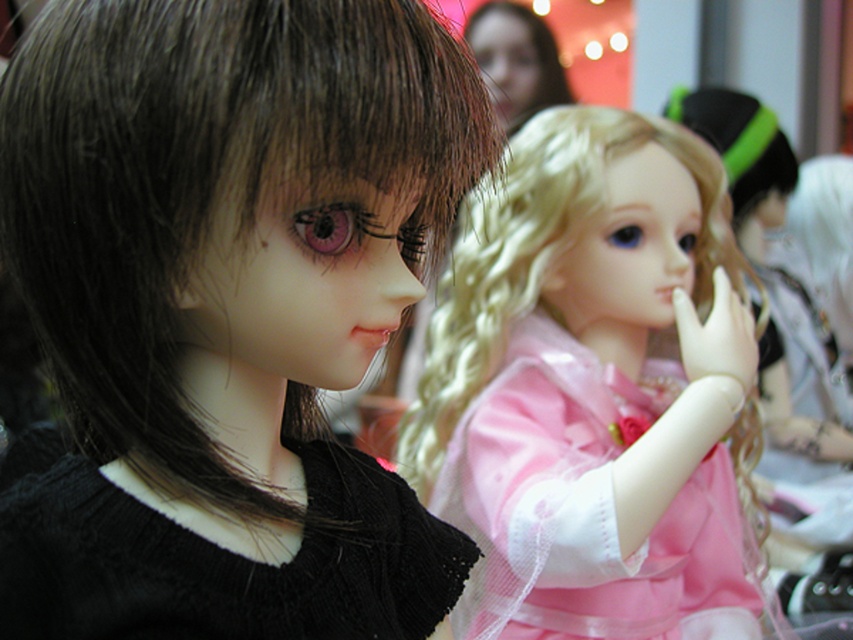
Is dark brown silky hair at left taller than black knitted dress at left?

Yes.

Between point (50, 152) and point (216, 634), which one is positioned behind?

Point (216, 634)

You are a GUI agent. You are given a task and a screenshot of the screen. Output one action in this format:
    pyautogui.click(x=<x>, y=<y>)
    Task: Click on the dark brown silky hair at left
    The image size is (853, 640).
    Given the screenshot: What is the action you would take?
    coord(227,216)

Does point (463, 419) come behind point (152, 516)?

Yes, point (463, 419) is behind point (152, 516).

How much distance is there between shiny blonde wig at center and black knitted dress at left?

shiny blonde wig at center is 16.45 inches away from black knitted dress at left.

Between point (637, 184) and point (225, 564), which one is positioned in front?

Point (225, 564) is more forward.

Find the location of `shiny blonde wig at center`. shiny blonde wig at center is located at coordinates (592, 390).

Between dark brown silky hair at left and shiny blonde wig at center, which one appears on the left side from the viewer's perspective?

dark brown silky hair at left

Between point (74, 420) and point (553, 520), which one is positioned behind?

Point (553, 520)

At what (x,y) coordinates should I click in order to perform the action: click on dark brown silky hair at left. Please return your answer as a coordinate pair (x, y). Looking at the image, I should click on (227, 216).